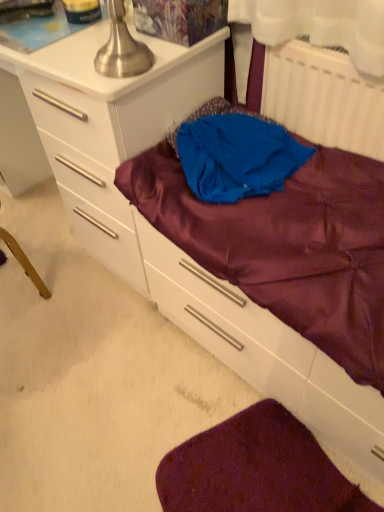
What do you see at coordinates (264, 351) in the screenshot? I see `satin purple drawer at center` at bounding box center [264, 351].

The height and width of the screenshot is (512, 384). What do you see at coordinates (256, 469) in the screenshot?
I see `purple satin sheet at lower right` at bounding box center [256, 469].

The height and width of the screenshot is (512, 384). Find the location of `satin purple mattress at center`. satin purple mattress at center is located at coordinates pos(286,245).

The width and height of the screenshot is (384, 512). Find the location of `white plastic radiator at upper right`. white plastic radiator at upper right is located at coordinates (324, 98).

Between blue fabric at center and purple satin sheet at lower right, which one has less height?

purple satin sheet at lower right is shorter.

I want to click on clothing located above the purple satin sheet at lower right (from the image's perspective), so click(237, 156).

Is blue fabric at center placed right next to purple satin sheet at lower right?

No, blue fabric at center is not in contact with purple satin sheet at lower right.

Does blue fabric at center appear on the right side of purple satin sheet at lower right?

No, blue fabric at center is not to the right of purple satin sheet at lower right.

From a real-world perspective, is satin purple drawer at center positioned above or below blue fabric at center?

Clearly, from a real-world perspective, satin purple drawer at center is below blue fabric at center.

Can you confirm if satin purple drawer at center is thinner than blue fabric at center?

No, satin purple drawer at center is not thinner than blue fabric at center.

Considering the sizes of satin purple drawer at center and blue fabric at center in the image, is satin purple drawer at center taller or shorter than blue fabric at center?

satin purple drawer at center is taller than blue fabric at center.

Do you think satin purple mattress at center is within white glossy chest of drawers at center, or outside of it?

satin purple mattress at center is not enclosed by white glossy chest of drawers at center.

Considering the relative sizes of satin purple mattress at center and white glossy chest of drawers at center in the image provided, is satin purple mattress at center bigger than white glossy chest of drawers at center?

Actually, satin purple mattress at center might be smaller than white glossy chest of drawers at center.

From a real-world perspective, is satin purple mattress at center physically below white glossy chest of drawers at center?

No, from a real-world perspective, satin purple mattress at center is not below white glossy chest of drawers at center.

Consider the image. What's the angular difference between white glossy chest of drawers at center and purple satin sheet at lower right's facing directions?

The angular difference between white glossy chest of drawers at center and purple satin sheet at lower right is 0.963 degrees.

Between white glossy chest of drawers at center and purple satin sheet at lower right, which one has larger width?

Wider between the two is white glossy chest of drawers at center.

From the image's perspective, which is above, white glossy chest of drawers at center or purple satin sheet at lower right?

white glossy chest of drawers at center is shown above in the image.

Is purple satin sheet at lower right at the right side of white glossy chest of drawers at center?

Yes, purple satin sheet at lower right is to the right of white glossy chest of drawers at center.

From a real-world perspective, does purple satin sheet at lower right sit lower than white glossy chest of drawers at center?

Yes.

Does purple satin sheet at lower right have a greater height compared to white glossy chest of drawers at center?

Incorrect, the height of purple satin sheet at lower right is not larger of that of white glossy chest of drawers at center.

From a real-world perspective, is white glossy chest of drawers at center above or below white plastic radiator at upper right?

Clearly, from a real-world perspective, white glossy chest of drawers at center is below white plastic radiator at upper right.

Would you say white glossy chest of drawers at center is a long distance from white plastic radiator at upper right?

That's not correct — white glossy chest of drawers at center is a little close to white plastic radiator at upper right.

Based on their sizes in the image, would you say white glossy chest of drawers at center is bigger or smaller than white plastic radiator at upper right?

white glossy chest of drawers at center is bigger than white plastic radiator at upper right.

Between white glossy chest of drawers at center and white plastic radiator at upper right, which one has less height?

With less height is white plastic radiator at upper right.

Is purple satin sheet at lower right with satin purple drawer at center?

purple satin sheet at lower right is not next to satin purple drawer at center, and they're not touching.

Can you confirm if purple satin sheet at lower right is thinner than satin purple drawer at center?

In fact, purple satin sheet at lower right might be wider than satin purple drawer at center.

Locate an element on the screen. This screenshot has width=384, height=512. sheet behind the satin purple drawer at center is located at coordinates (256, 469).

Is purple satin sheet at lower right taller or shorter than satin purple drawer at center?

Clearly, purple satin sheet at lower right is shorter compared to satin purple drawer at center.

Where is `sheet below the blue fabric at center (from a real-world perspective)`? Image resolution: width=384 pixels, height=512 pixels. sheet below the blue fabric at center (from a real-world perspective) is located at coordinates (256, 469).

You are a GUI agent. You are given a task and a screenshot of the screen. Output one action in this format:
    pyautogui.click(x=<x>, y=<y>)
    Task: Click on the clothing above the satin purple drawer at center (from the image's perspective)
    
    Given the screenshot: What is the action you would take?
    pyautogui.click(x=237, y=156)

Based on their spatial positions, is white plastic radiator at upper right or satin purple drawer at center closer to white glossy chest of drawers at center?

satin purple drawer at center is positioned closer to the anchor white glossy chest of drawers at center.

Considering their positions, is blue fabric at center positioned further to satin purple mattress at center than white glossy chest of drawers at center?

Among the two, white glossy chest of drawers at center is located further to satin purple mattress at center.

When comparing their distances from purple satin sheet at lower right, does white plastic radiator at upper right or satin purple drawer at center seem further?

white plastic radiator at upper right lies further to purple satin sheet at lower right than the other object.

From the image, which object appears to be farther from purple satin sheet at lower right, blue fabric at center or satin purple mattress at center?

Based on the image, blue fabric at center appears to be further to purple satin sheet at lower right.

From the image, which object appears to be nearer to white plastic radiator at upper right, satin purple drawer at center or blue fabric at center?

blue fabric at center.

From the image, which object appears to be farther from white plastic radiator at upper right, white glossy chest of drawers at center or purple satin sheet at lower right?

purple satin sheet at lower right lies further to white plastic radiator at upper right than the other object.

From the image, which object appears to be farther from purple satin sheet at lower right, satin purple mattress at center or white glossy chest of drawers at center?

white glossy chest of drawers at center is positioned further to the anchor purple satin sheet at lower right.

Which object lies nearer to the anchor point purple satin sheet at lower right, satin purple mattress at center or blue fabric at center?

satin purple mattress at center.

This screenshot has width=384, height=512. Find the location of `clothing located between white glossy chest of drawers at center and satin purple mattress at center in the left-right direction`. clothing located between white glossy chest of drawers at center and satin purple mattress at center in the left-right direction is located at coordinates (237, 156).

Where is `mattress that lies between white glossy chest of drawers at center and purple satin sheet at lower right from top to bottom`? This screenshot has height=512, width=384. mattress that lies between white glossy chest of drawers at center and purple satin sheet at lower right from top to bottom is located at coordinates (x=286, y=245).

Find the location of a particular element. The width and height of the screenshot is (384, 512). radiator between white glossy chest of drawers at center and purple satin sheet at lower right vertically is located at coordinates (324, 98).

Identify the location of clothing between white glossy chest of drawers at center and satin purple drawer at center in the horizontal direction. (237, 156).